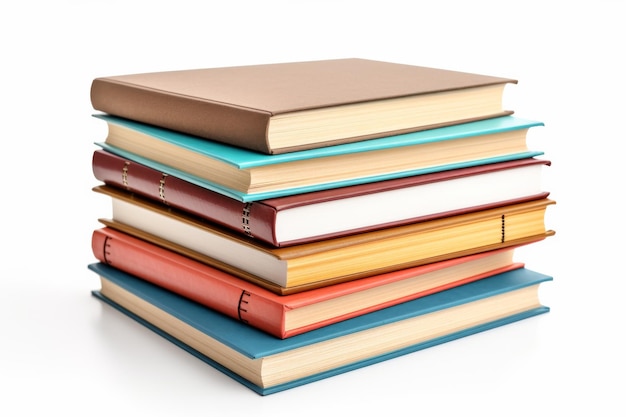
Where is `books`? This screenshot has height=417, width=626. books is located at coordinates coord(238,125), coord(240,175), coord(280,223), coord(295,271), coord(322,314), coord(336,344).